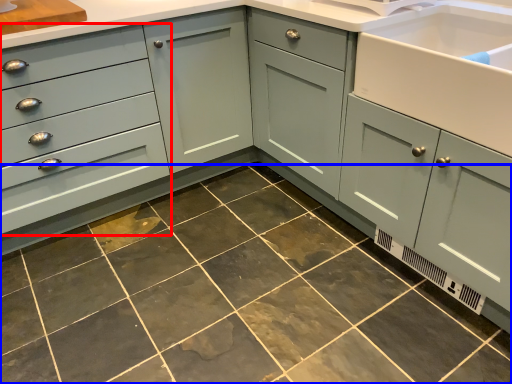
Question: Which point is further to the camera, drawer (highlighted by a red box) or ceramic tile (highlighted by a blue box)?

Choices:
 (A) drawer
 (B) ceramic tile

Answer: (A)